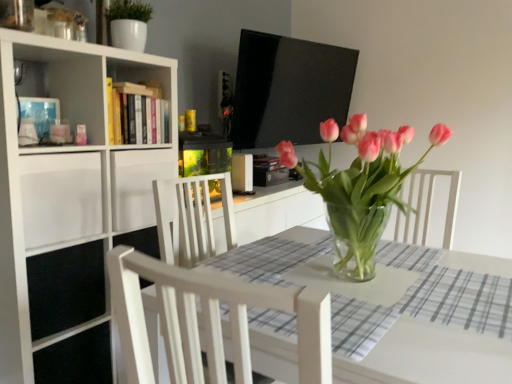
Question: From the image's perspective, is hardcover book at upper center located beneath white matte drawer at left, which is the 1th drawer in right-to-left order?

Choices:
 (A) no
 (B) yes

Answer: (A)

Question: Considering the relative sizes of hardcover book at upper center and white matte drawer at left, which is the 2th drawer in left-to-right order, in the image provided, is hardcover book at upper center thinner than white matte drawer at left, which is the 2th drawer in left-to-right order,?

Choices:
 (A) yes
 (B) no

Answer: (A)

Question: Considering the relative positions of hardcover book at upper center and white matte drawer at left, which is the 2th drawer in left-to-right order, in the image provided, is hardcover book at upper center to the right of white matte drawer at left, which is the 2th drawer in left-to-right order, from the viewer's perspective?

Choices:
 (A) no
 (B) yes

Answer: (B)

Question: Is hardcover book at upper center positioned behind white matte drawer at left, which is the 1th drawer in right-to-left order?

Choices:
 (A) no
 (B) yes

Answer: (B)

Question: Is white matte drawer at left, which is the 2th drawer in left-to-right order, inside hardcover book at upper center?

Choices:
 (A) yes
 (B) no

Answer: (B)

Question: From their relative heights in the image, would you say white matte bookcase at left is taller or shorter than clear glass table at center?

Choices:
 (A) tall
 (B) short

Answer: (A)

Question: Considering the positions of white matte bookcase at left and clear glass table at center in the image, is white matte bookcase at left bigger or smaller than clear glass table at center?

Choices:
 (A) big
 (B) small

Answer: (B)

Question: Is point (1, 168) closer or farther from the camera than point (254, 344)?

Choices:
 (A) closer
 (B) farther

Answer: (B)

Question: From the image's perspective, is white matte bookcase at left located above or below clear glass table at center?

Choices:
 (A) above
 (B) below

Answer: (A)

Question: Is point (95, 226) closer or farther from the camera than point (115, 43)?

Choices:
 (A) closer
 (B) farther

Answer: (A)

Question: In terms of height, does white matte drawer at left, marked as the 2th drawer in a right-to-left arrangement, look taller or shorter compared to white glossy pot at upper left?

Choices:
 (A) short
 (B) tall

Answer: (B)

Question: Is white matte drawer at left, marked as the 2th drawer in a right-to-left arrangement, wider or thinner than white glossy pot at upper left?

Choices:
 (A) wide
 (B) thin

Answer: (A)

Question: Relative to white glossy pot at upper left, is white matte drawer at left, marked as the 2th drawer in a right-to-left arrangement, in front or behind?

Choices:
 (A) behind
 (B) front

Answer: (B)

Question: Would you say white glossy pot at upper left is to the left or to the right of white matte bookcase at left in the picture?

Choices:
 (A) left
 (B) right

Answer: (B)

Question: Considering the positions of white glossy pot at upper left and white matte bookcase at left in the image, is white glossy pot at upper left wider or thinner than white matte bookcase at left?

Choices:
 (A) wide
 (B) thin

Answer: (B)